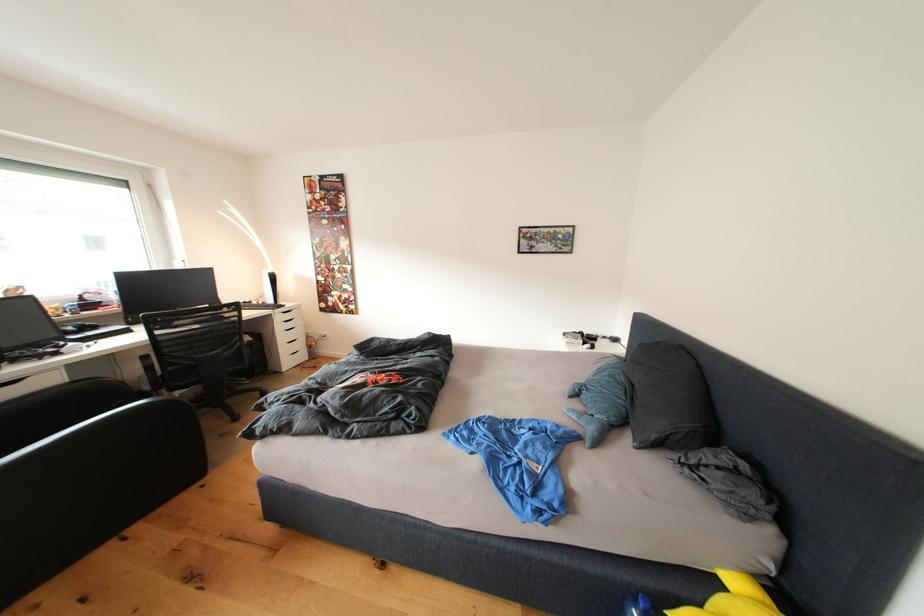
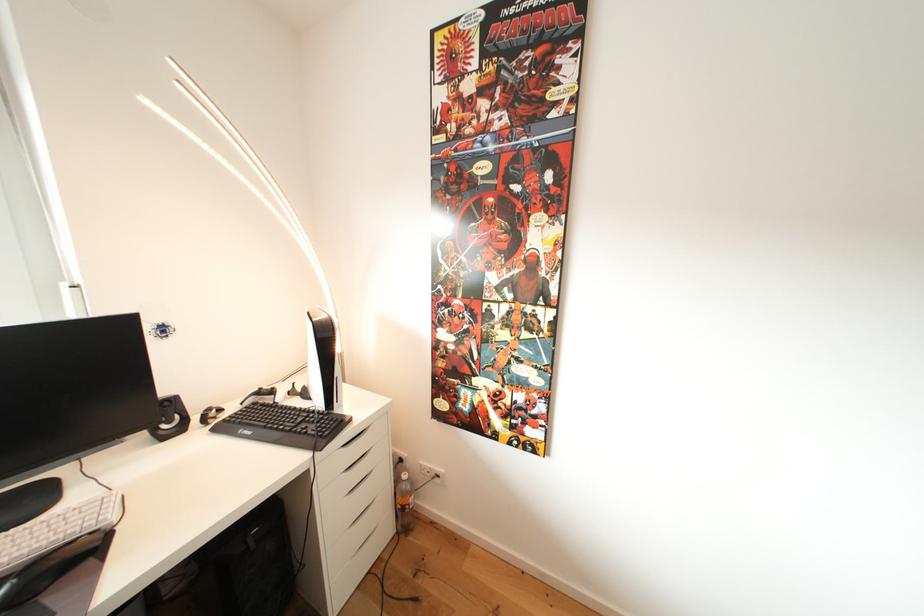
The images are taken continuously from a first-person perspective. In which direction are you moving?

The cameraman moved toward left, forward.